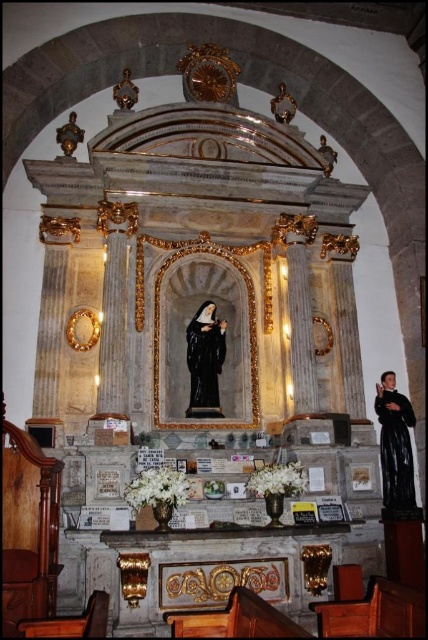
Question: Is black matte robe at right below black glossy statue at center?

Choices:
 (A) no
 (B) yes

Answer: (B)

Question: Which point is farther to the camera?

Choices:
 (A) black glossy statue at center
 (B) black matte robe at right

Answer: (A)

Question: Can you confirm if black matte robe at right is positioned below black glossy statue at center?

Choices:
 (A) no
 (B) yes

Answer: (B)

Question: Is black matte robe at right above black glossy statue at center?

Choices:
 (A) no
 (B) yes

Answer: (A)